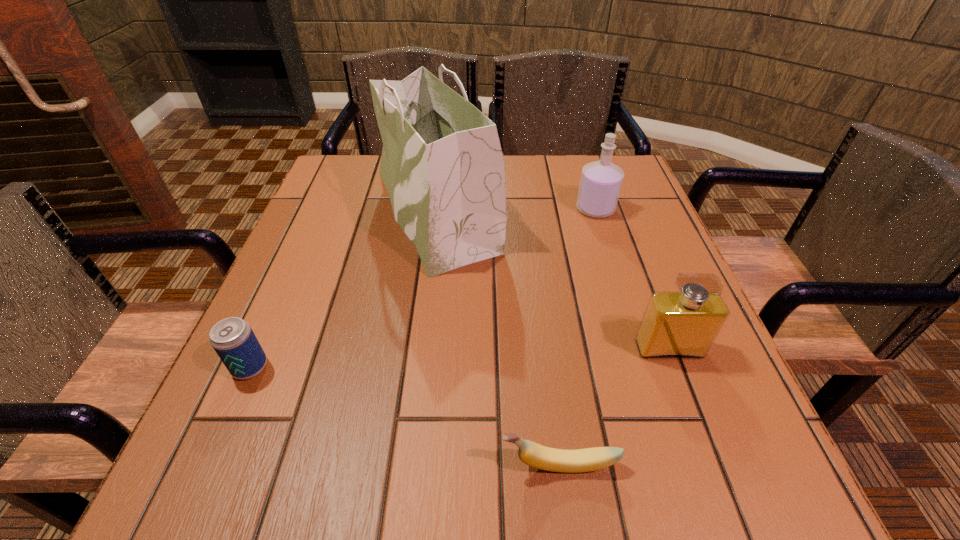
I want to click on blank region between the leftmost object and the nearest object, so click(x=405, y=416).

This screenshot has height=540, width=960. Identify the location of vacant point located between the leftmost object and the shortest object. (405, 416).

The width and height of the screenshot is (960, 540). I want to click on free space between the farther perfume and the tallest object, so click(516, 210).

Identify the location of free spot between the leftmost object and the nearer perfume. (460, 358).

Identify the location of vacant space that's between the tallest object and the beer can. The width and height of the screenshot is (960, 540). (343, 288).

At what (x,y) coordinates should I click in order to perform the action: click on free space between the banana and the beer can. Please return your answer as a coordinate pair (x, y). Image resolution: width=960 pixels, height=540 pixels. Looking at the image, I should click on (405, 416).

Where is `vacant area that lies between the shortest object and the farther perfume`? vacant area that lies between the shortest object and the farther perfume is located at coordinates click(577, 337).

Locate which object is the closest to the nearer perfume. Please provide its 2D coordinates. Your answer should be formatted as a tuple, i.e. [(x, y)], where the tuple contains the x and y coordinates of a point satisfying the conditions above.

[(535, 455)]

Where is `object identified as the fourth closest to the nearer perfume`? The width and height of the screenshot is (960, 540). object identified as the fourth closest to the nearer perfume is located at coordinates (233, 339).